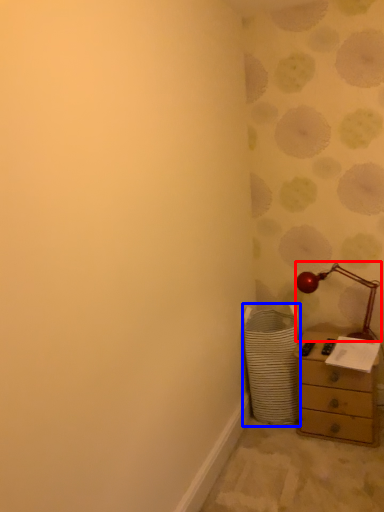
Question: Among these objects, which one is nearest to the camera, table lamp (highlighted by a red box) or laundry basket (highlighted by a blue box)?

Choices:
 (A) table lamp
 (B) laundry basket

Answer: (B)